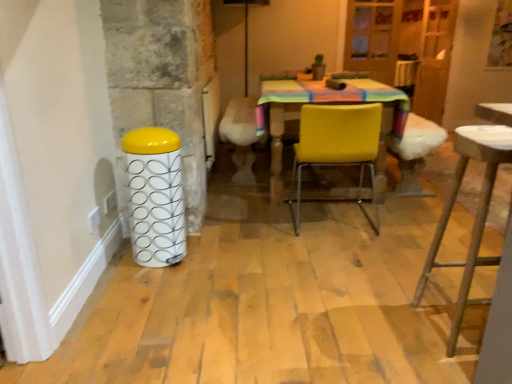
Question: Does metallic stool at right appear on the left side of yellow matte chair at center?

Choices:
 (A) yes
 (B) no

Answer: (B)

Question: From the image's perspective, does metallic stool at right appear lower than yellow matte chair at center?

Choices:
 (A) no
 (B) yes

Answer: (B)

Question: Could you tell me if metallic stool at right is facing yellow matte chair at center?

Choices:
 (A) no
 (B) yes

Answer: (A)

Question: Considering the relative sizes of metallic stool at right and yellow matte chair at center in the image provided, is metallic stool at right shorter than yellow matte chair at center?

Choices:
 (A) no
 (B) yes

Answer: (A)

Question: Considering the relative positions of metallic stool at right and yellow matte chair at center in the image provided, is metallic stool at right to the right of yellow matte chair at center from the viewer's perspective?

Choices:
 (A) yes
 (B) no

Answer: (A)

Question: From their relative heights in the image, would you say yellow matte chair at center is taller or shorter than white glossy bar stool at left?

Choices:
 (A) short
 (B) tall

Answer: (B)

Question: Based on their positions, is yellow matte chair at center located to the left or right of white glossy bar stool at left?

Choices:
 (A) right
 (B) left

Answer: (A)

Question: From the image's perspective, is yellow matte chair at center positioned above or below white glossy bar stool at left?

Choices:
 (A) above
 (B) below

Answer: (A)

Question: Is point [x=351, y=198] closer or farther from the camera than point [x=123, y=148]?

Choices:
 (A) farther
 (B) closer

Answer: (A)

Question: From the image's perspective, is white glossy bar stool at left positioned above or below metallic stool at right?

Choices:
 (A) below
 (B) above

Answer: (B)

Question: From a real-world perspective, relative to metallic stool at right, is white glossy bar stool at left vertically above or below?

Choices:
 (A) below
 (B) above

Answer: (A)

Question: Considering the positions of white glossy bar stool at left and metallic stool at right in the image, is white glossy bar stool at left wider or thinner than metallic stool at right?

Choices:
 (A) thin
 (B) wide

Answer: (A)

Question: Considering the positions of white glossy bar stool at left and metallic stool at right in the image, is white glossy bar stool at left bigger or smaller than metallic stool at right?

Choices:
 (A) big
 (B) small

Answer: (B)

Question: Which is correct: metallic stool at right is inside yellow matte chair at center, or outside of it?

Choices:
 (A) inside
 (B) outside

Answer: (B)

Question: Considering their positions, is metallic stool at right located in front of or behind yellow matte chair at center?

Choices:
 (A) front
 (B) behind

Answer: (A)